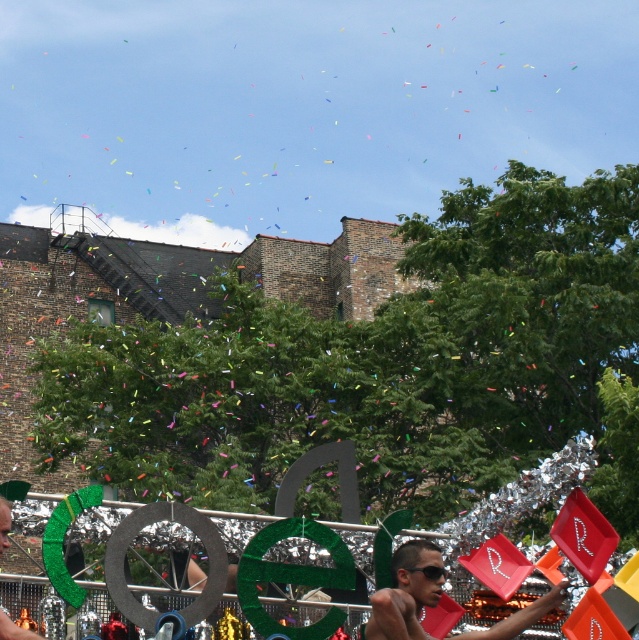
Who is positioned more to the right, shiny black sunglasses at center or shiny metallic sunglasses at center?

shiny black sunglasses at center is more to the right.

Who is more distant from viewer, [389,596] or [13,637]?

The point [389,596] is more distant.

Identify the location of shiny black sunglasses at center. (404, 595).

Is point (0, 554) closer to viewer compared to point (426, 579)?

Yes, it is in front of point (426, 579).

Can you confirm if shiny metallic sunglasses at center is bigger than black plastic goggles at center?

Correct, shiny metallic sunglasses at center is larger in size than black plastic goggles at center.

Is point (31, 637) more distant than point (406, 566)?

That is False.

The height and width of the screenshot is (640, 639). In order to click on shiny metallic sunglasses at center in this screenshot , I will do `click(13, 628)`.

Does shiny black sunglasses at center appear over black plastic goggles at center?

Incorrect, shiny black sunglasses at center is not positioned above black plastic goggles at center.

Does shiny black sunglasses at center appear on the left side of black plastic goggles at center?

Indeed, shiny black sunglasses at center is positioned on the left side of black plastic goggles at center.

This screenshot has width=639, height=640. What do you see at coordinates (404, 595) in the screenshot? I see `shiny black sunglasses at center` at bounding box center [404, 595].

The image size is (639, 640). I want to click on shiny black sunglasses at center, so click(404, 595).